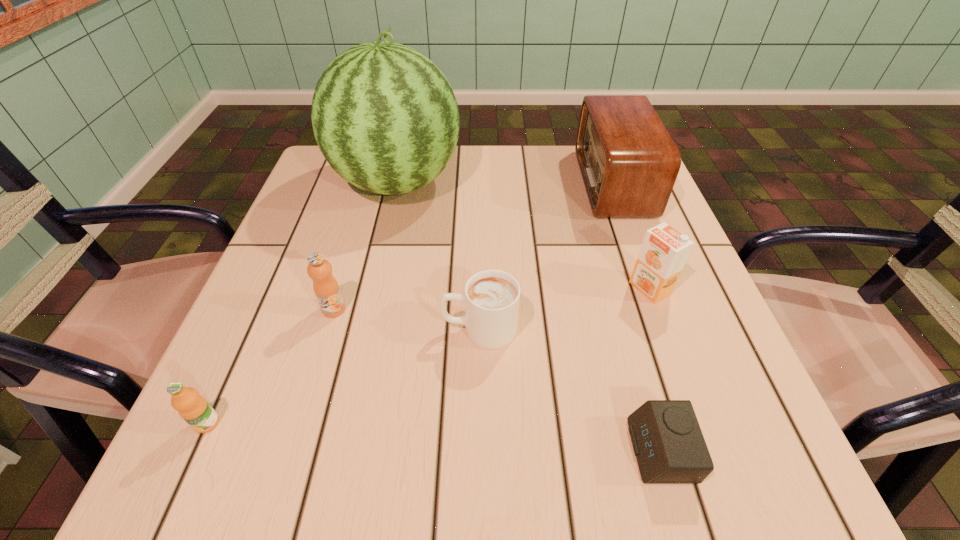
You are a GUI agent. You are given a task and a screenshot of the screen. Output one action in this format:
    pyautogui.click(x=<x>, y=<y>)
    Task: Click on the free space located 0.260m on the front panel of the radio receiver
    
    Given the screenshot: What is the action you would take?
    pyautogui.click(x=476, y=183)

Identify the location of vacant space positioned 0.080m on the front panel of the radio receiver. The image size is (960, 540). (550, 183).

The height and width of the screenshot is (540, 960). Find the location of `vacant region located 0.160m on the front of the rightmost orange juice`. vacant region located 0.160m on the front of the rightmost orange juice is located at coordinates (684, 381).

This screenshot has height=540, width=960. Identify the location of free location located on the front label of the second orange juice from right to left. (317, 367).

This screenshot has height=540, width=960. In order to click on free space located 0.210m on the side with the handle of the cappuccino in this screenshot , I will do `click(321, 329)`.

Where is `free space located on the side with the handle of the cappuccino`? Image resolution: width=960 pixels, height=540 pixels. free space located on the side with the handle of the cappuccino is located at coordinates (257, 329).

This screenshot has width=960, height=540. In order to click on free space located on the side with the handle of the cappuccino in this screenshot , I will do (x=292, y=329).

The image size is (960, 540). I want to click on vacant region located on the front-facing side of the shortest object, so click(x=433, y=450).

Where is `free space located 0.250m on the front-facing side of the shortest object`? free space located 0.250m on the front-facing side of the shortest object is located at coordinates (455, 450).

Where is `vacant space located 0.070m on the front-facing side of the shortest object`? vacant space located 0.070m on the front-facing side of the shortest object is located at coordinates (583, 450).